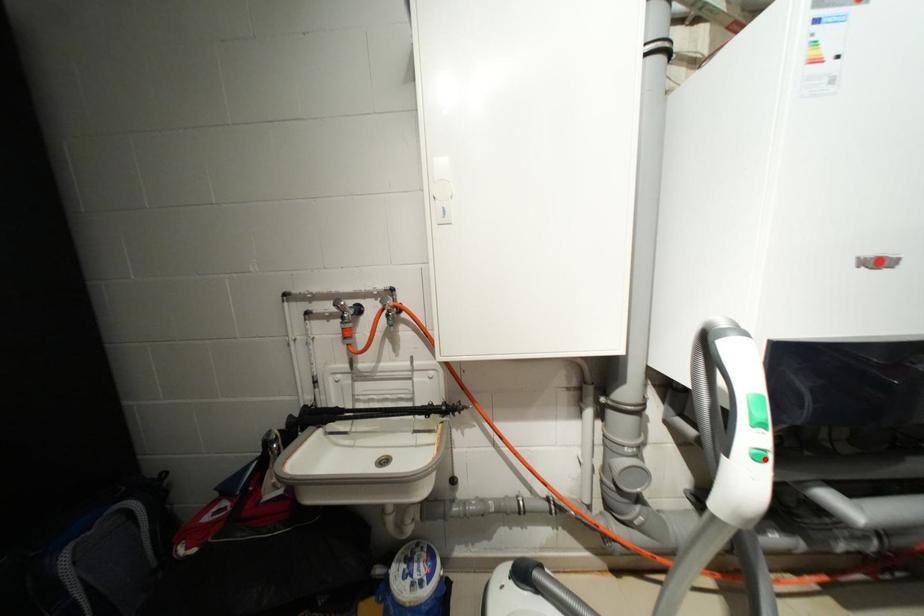
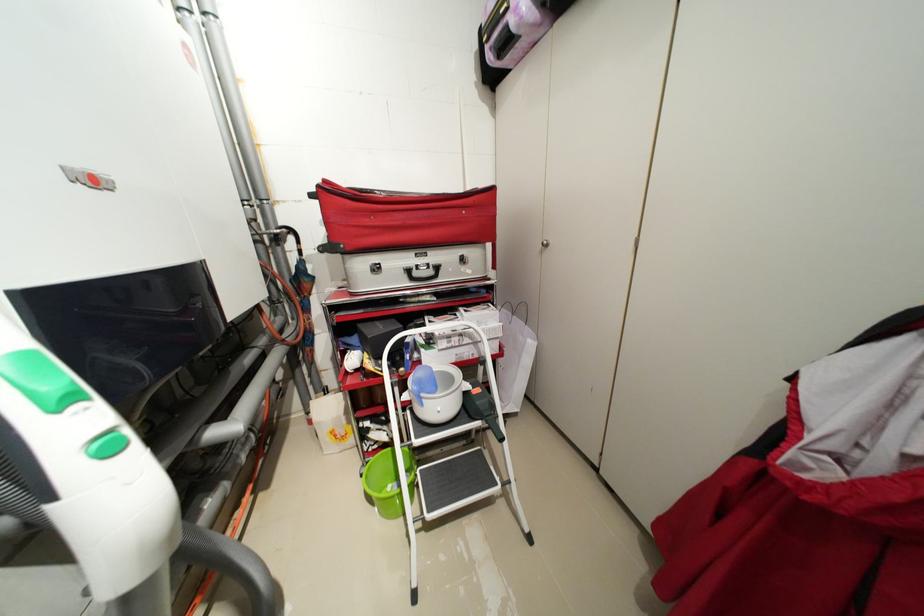
The point at the highlighted location is marked in the first image. Where is the corresponding point in the second image?

(117, 454)